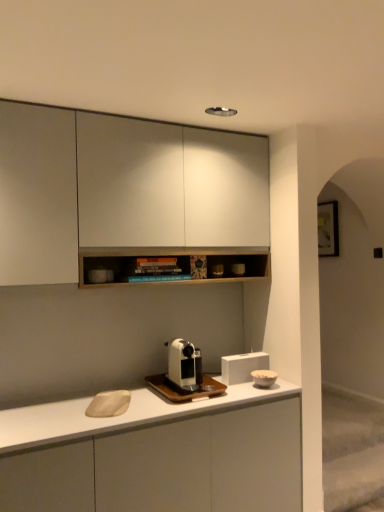
Question: Does white matte cabinet at upper center, the second cabinetry in the bottom-to-top sequence, come behind white glossy coffee machine at center, which is counted as the 2th coffee machine, starting from the bottom?

Choices:
 (A) no
 (B) yes

Answer: (A)

Question: Does white matte cabinet at upper center, the second cabinetry in the bottom-to-top sequence, have a larger size compared to white glossy coffee machine at center, which is counted as the 2th coffee machine, starting from the bottom?

Choices:
 (A) no
 (B) yes

Answer: (B)

Question: From a real-world perspective, is white matte cabinet at upper center, which appears as the first cabinetry when viewed from the top, below white glossy coffee machine at center, the first coffee machine when ordered from top to bottom?

Choices:
 (A) no
 (B) yes

Answer: (A)

Question: Does white matte cabinet at upper center, which appears as the first cabinetry when viewed from the top, appear on the right side of white glossy coffee machine at center, the first coffee machine when ordered from top to bottom?

Choices:
 (A) yes
 (B) no

Answer: (B)

Question: Is white matte cabinet at upper center, which appears as the first cabinetry when viewed from the top, facing away from white glossy coffee machine at center, which is counted as the 2th coffee machine, starting from the bottom?

Choices:
 (A) yes
 (B) no

Answer: (B)

Question: Is white matte speaker at center, the 1th appliance viewed from the back, inside the boundaries of white glossy coffee machine at center, which is counted as the 2th coffee machine, starting from the bottom, or outside?

Choices:
 (A) outside
 (B) inside

Answer: (A)

Question: From the image's perspective, is white matte speaker at center, the 1th appliance viewed from the back, positioned above or below white glossy coffee machine at center, which is counted as the 2th coffee machine, starting from the bottom?

Choices:
 (A) below
 (B) above

Answer: (A)

Question: Does point (244, 361) appear closer or farther from the camera than point (175, 369)?

Choices:
 (A) farther
 (B) closer

Answer: (A)

Question: In terms of size, does white matte speaker at center, the 1th appliance viewed from the back, appear bigger or smaller than white glossy coffee machine at center, which is counted as the 2th coffee machine, starting from the bottom?

Choices:
 (A) small
 (B) big

Answer: (B)

Question: Which is correct: white matte cabinet at center, which is the second cabinetry from top to bottom, is inside white matte cabinet at upper center, which appears as the first cabinetry when viewed from the top, or outside of it?

Choices:
 (A) outside
 (B) inside

Answer: (A)

Question: In terms of size, does white matte cabinet at center, marked as the 1th cabinetry in a bottom-to-top arrangement, appear bigger or smaller than white matte cabinet at upper center, the second cabinetry in the bottom-to-top sequence?

Choices:
 (A) big
 (B) small

Answer: (A)

Question: From a real-world perspective, relative to white matte cabinet at upper center, which appears as the first cabinetry when viewed from the top, is white matte cabinet at center, which is the second cabinetry from top to bottom, vertically above or below?

Choices:
 (A) below
 (B) above

Answer: (A)

Question: Is white matte cabinet at center, which is the second cabinetry from top to bottom, taller or shorter than white matte cabinet at upper center, which appears as the first cabinetry when viewed from the top?

Choices:
 (A) short
 (B) tall

Answer: (A)

Question: Does point (185, 345) appear closer or farther from the camera than point (268, 379)?

Choices:
 (A) closer
 (B) farther

Answer: (A)

Question: From a real-world perspective, is white glossy coffee machine at center, which is counted as the 2th coffee machine, starting from the bottom, physically located above or below porcelain bowl at right, the second appliance viewed from the back?

Choices:
 (A) below
 (B) above

Answer: (B)